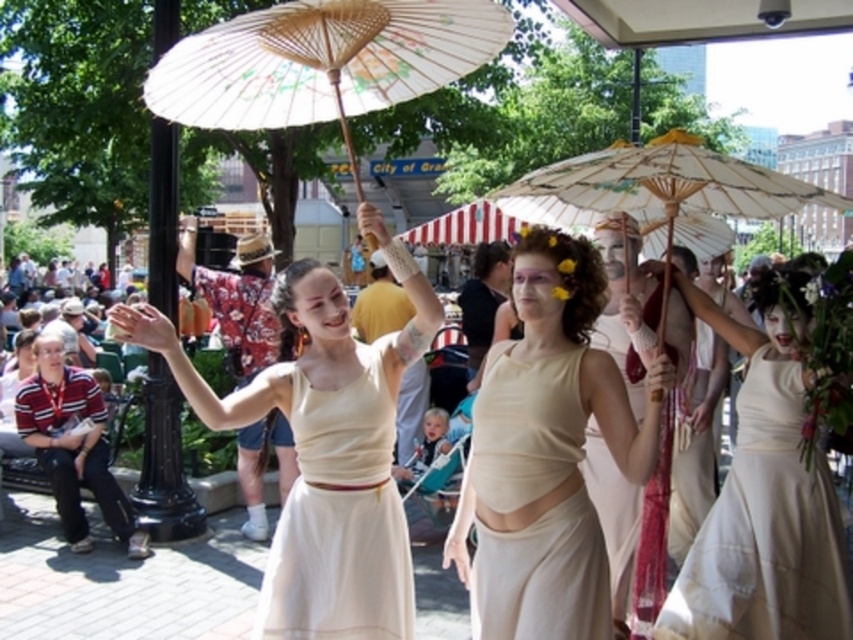
Who is more distant from viewer, (x=409, y=600) or (x=589, y=636)?

The point (x=409, y=600) is more distant.

Is point (187, 384) behind point (552, 509)?

Yes.

The height and width of the screenshot is (640, 853). Find the location of `matte cream dress at center`. matte cream dress at center is located at coordinates (325, 451).

Is point (579, 259) closer to viewer compared to point (699, 579)?

Yes, point (579, 259) is closer to viewer.

Measure the distance between matte cream fabric dress at center and white cotton dress at center.

They are 6.89 feet apart.

Who is more forward, (x=503, y=506) or (x=728, y=577)?

Point (x=503, y=506)

I want to click on matte cream fabric dress at center, so click(x=546, y=452).

Is point (329, 628) more distant than point (654, 140)?

No, it is not.

Is point (393, 336) positioned before point (807, 202)?

Yes, point (393, 336) is closer to viewer.

Find the location of a particular element. Image resolution: width=853 pixels, height=640 pixels. matte cream dress at center is located at coordinates (325, 451).